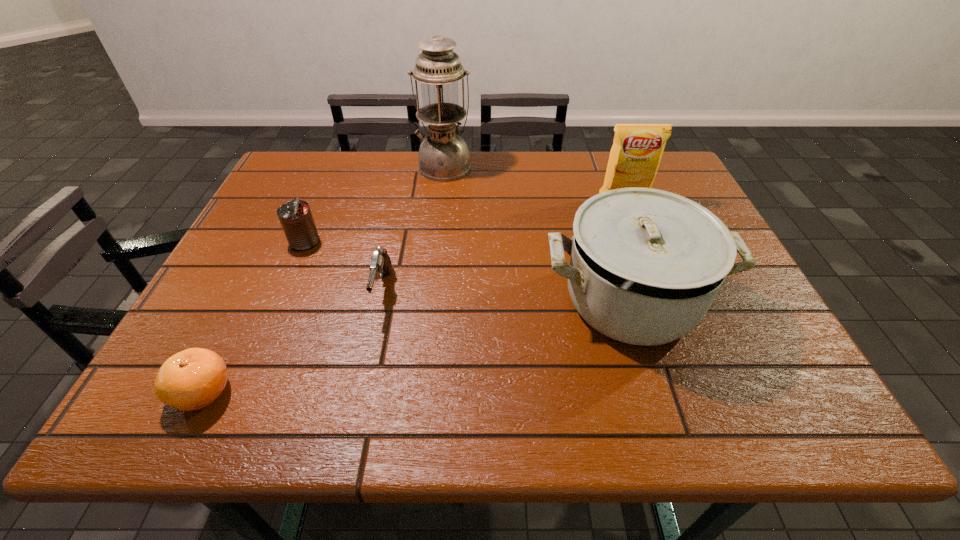
Select which object is the fourth closest to the pistol. Please provide its 2D coordinates. Your answer should be formatted as a tuple, i.e. [(x, y)], where the tuple contains the x and y coordinates of a point satisfying the conditions above.

[(443, 156)]

Locate an element on the screen. Image resolution: width=960 pixels, height=540 pixels. the second closest object to the shortest object is located at coordinates (295, 216).

You are a GUI agent. You are given a task and a screenshot of the screen. Output one action in this format:
    pyautogui.click(x=<x>, y=<y>)
    Task: Click on the free location that satisfies the following two spatial constraints: 1. on the back side of the third shortest object; 2. on the left side of the clementine
    
    Given the screenshot: What is the action you would take?
    pyautogui.click(x=277, y=241)